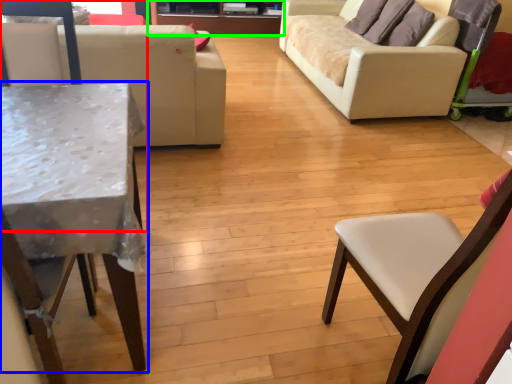
Question: Which object is positioned closest to chair (highlighted by a red box)? Select from table (highlighted by a blue box) and entertainment center (highlighted by a green box).

Choices:
 (A) table
 (B) entertainment center

Answer: (A)